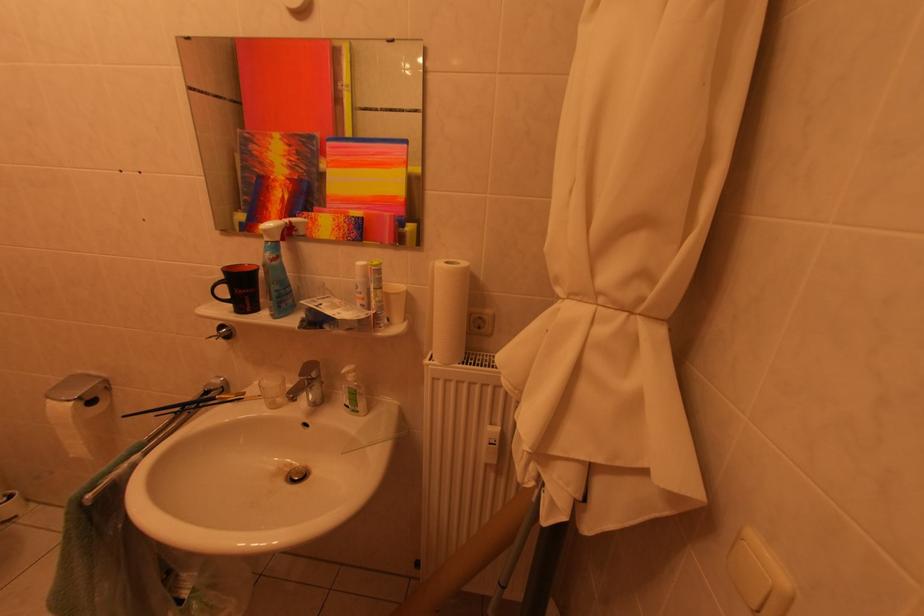
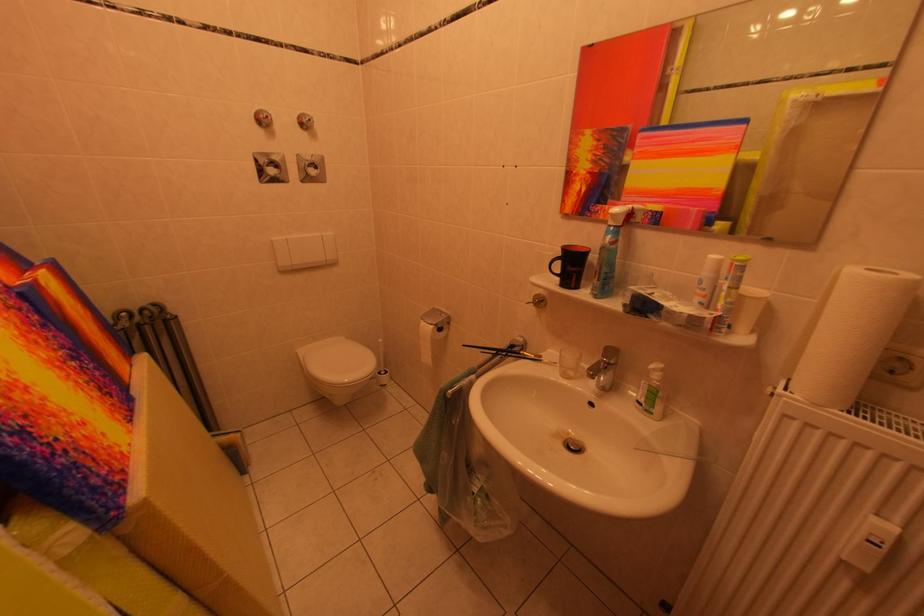
Find the pixel in the second image that matches point 388,305 in the first image.

(739, 307)